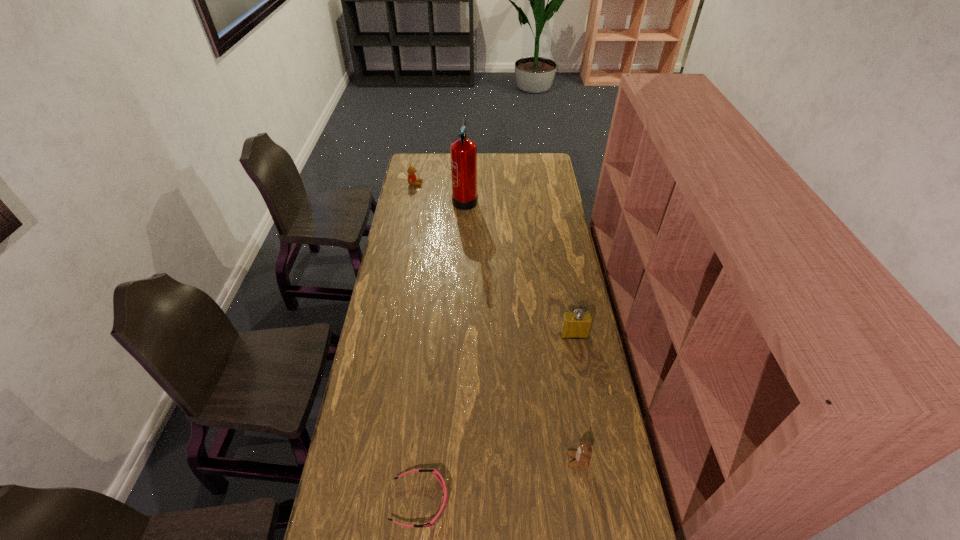
Find the location of a particular element. This screenshot has width=960, height=540. vacant region located on the front-facing side of the left teddy bear is located at coordinates (431, 184).

Image resolution: width=960 pixels, height=540 pixels. In order to click on free spot located on the front-facing side of the shorter teddy bear in this screenshot , I will do `click(492, 460)`.

The width and height of the screenshot is (960, 540). What are the coordinates of `free space located on the front-facing side of the shorter teddy bear` in the screenshot? It's located at click(x=533, y=460).

Find the location of a particular element. The width and height of the screenshot is (960, 540). free spot located 0.340m on the front-facing side of the shorter teddy bear is located at coordinates (460, 460).

Find the location of a particular element. The image size is (960, 540). vacant point located on the front-facing side of the shortest object is located at coordinates (540, 501).

Where is `object located in the left edge section of the desktop`? This screenshot has width=960, height=540. object located in the left edge section of the desktop is located at coordinates (412, 179).

You are a GUI agent. You are given a task and a screenshot of the screen. Output one action in this format:
    pyautogui.click(x=<x>, y=<y>)
    Task: Click on the perfume that is at the right edge
    Image resolution: width=960 pixels, height=540 pixels.
    Given the screenshot: What is the action you would take?
    pyautogui.click(x=577, y=324)

Where is `teddy bear situated at the right edge`? teddy bear situated at the right edge is located at coordinates (582, 456).

In the image, there is a desktop. At what (x,y) coordinates should I click in order to perform the action: click on vacant space at the left edge. Please return your answer as a coordinate pair (x, y). Looking at the image, I should click on (350, 456).

Where is `free location at the right edge`? free location at the right edge is located at coordinates (565, 401).